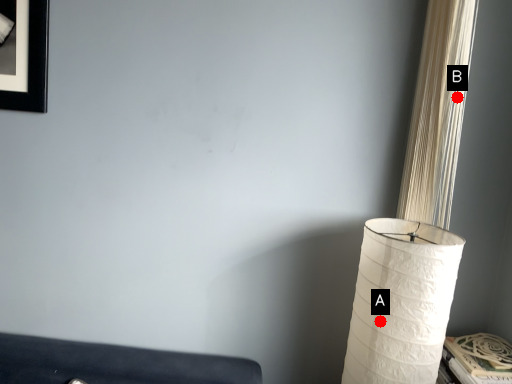
Question: Two points are circled on the image, labeled by A and B beside each circle. Which of the following is the closest to the observer?

Choices:
 (A) A is closer
 (B) B is closer

Answer: (A)